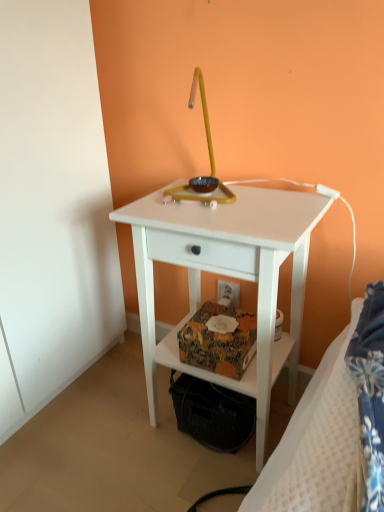
Where is `free location above white matte nightstand at center (from a real-world perspective)`? This screenshot has height=512, width=384. free location above white matte nightstand at center (from a real-world perspective) is located at coordinates (210, 198).